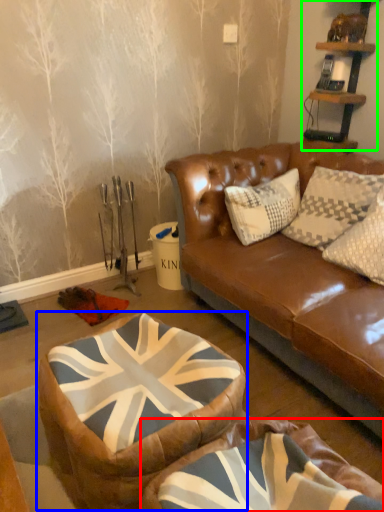
Question: Which object is the closest to the bean bag chair (highlighted by a red box)? Choose among these: bean bag chair (highlighted by a blue box) or shelf (highlighted by a green box).

Choices:
 (A) bean bag chair
 (B) shelf

Answer: (A)